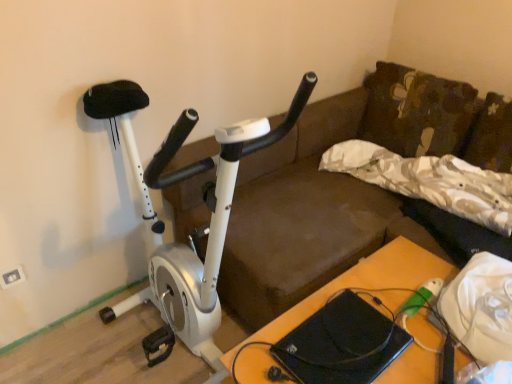
Question: Is wooden table at lower right located within white plastic electric outlet at upper left?

Choices:
 (A) yes
 (B) no

Answer: (B)

Question: Is white plastic electric outlet at upper left at the right side of wooden table at lower right?

Choices:
 (A) no
 (B) yes

Answer: (A)

Question: Is the depth of white plastic electric outlet at upper left greater than that of wooden table at lower right?

Choices:
 (A) yes
 (B) no

Answer: (A)

Question: Considering the relative sizes of white plastic electric outlet at upper left and wooden table at lower right in the image provided, is white plastic electric outlet at upper left smaller than wooden table at lower right?

Choices:
 (A) yes
 (B) no

Answer: (A)

Question: Is the depth of white plastic electric outlet at upper left less than that of wooden table at lower right?

Choices:
 (A) no
 (B) yes

Answer: (A)

Question: From the image's perspective, is white plastic electric outlet at upper left above wooden table at lower right?

Choices:
 (A) no
 (B) yes

Answer: (B)

Question: Could you tell me if wooden table at lower right is turned towards white metallic stationary bicycle at left?

Choices:
 (A) yes
 (B) no

Answer: (B)

Question: Is wooden table at lower right positioned before white metallic stationary bicycle at left?

Choices:
 (A) yes
 (B) no

Answer: (B)

Question: From the image's perspective, is wooden table at lower right located beneath white metallic stationary bicycle at left?

Choices:
 (A) no
 (B) yes

Answer: (B)

Question: Does wooden table at lower right lie behind white metallic stationary bicycle at left?

Choices:
 (A) yes
 (B) no

Answer: (A)

Question: Does wooden table at lower right appear on the right side of white metallic stationary bicycle at left?

Choices:
 (A) no
 (B) yes

Answer: (B)

Question: Can you confirm if wooden table at lower right is shorter than white metallic stationary bicycle at left?

Choices:
 (A) yes
 (B) no

Answer: (A)

Question: Is there a large distance between white plastic electric outlet at upper left and white metallic stationary bicycle at left?

Choices:
 (A) no
 (B) yes

Answer: (A)